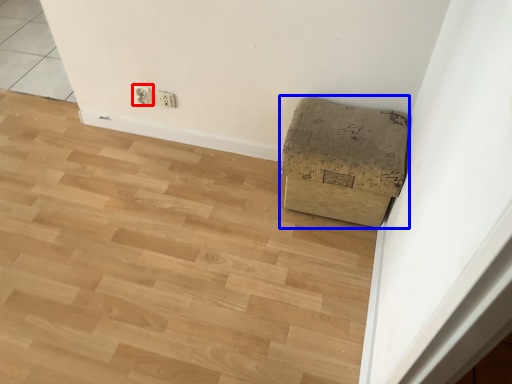
Question: Which object is closer to the camera taking this photo, electric outlet (highlighted by a red box) or furniture (highlighted by a blue box)?

Choices:
 (A) electric outlet
 (B) furniture

Answer: (B)